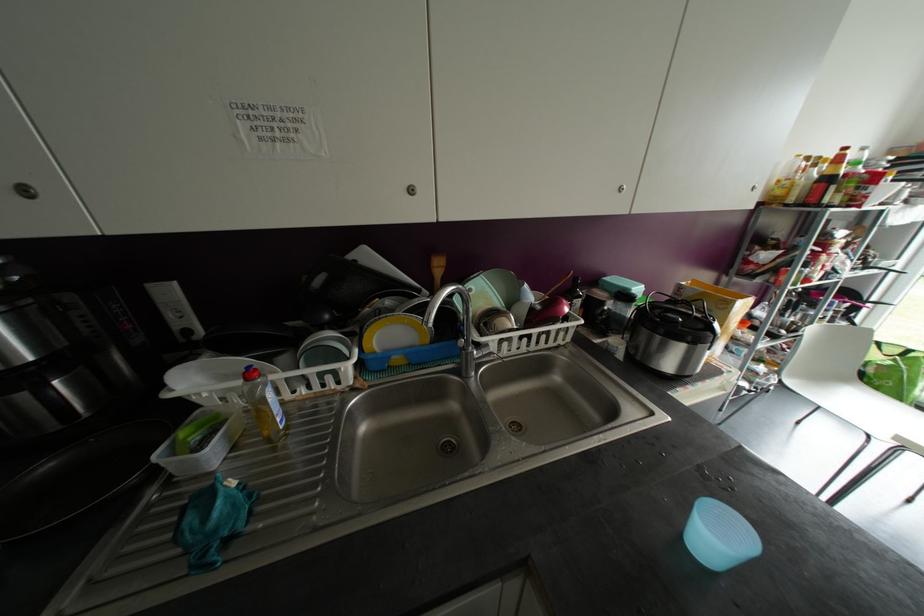
Find where to sit the chair sitting surface. Please return your answer as a coordinate pair (x, y).

(867, 411)